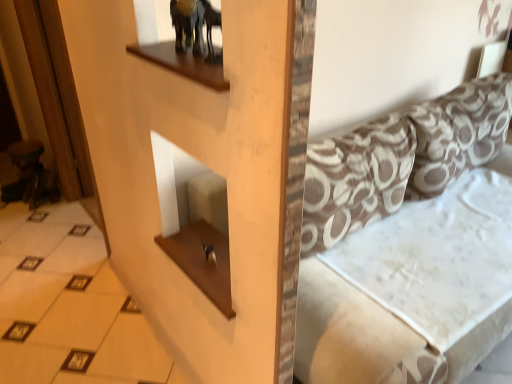
Question: Could you tell me if white glossy tile at lower left is turned towards patterned fabric pillow at right, which is counted as the 1th pillow, starting from the right?

Choices:
 (A) yes
 (B) no

Answer: (B)

Question: Is white glossy tile at lower left wider than patterned fabric pillow at right, the 2th pillow positioned from the left?

Choices:
 (A) no
 (B) yes

Answer: (B)

Question: From the image's perspective, does white glossy tile at lower left appear lower than patterned fabric pillow at right, which is counted as the 1th pillow, starting from the right?

Choices:
 (A) no
 (B) yes

Answer: (B)

Question: Would you say white glossy tile at lower left is outside patterned fabric pillow at right, the 2th pillow positioned from the left?

Choices:
 (A) yes
 (B) no

Answer: (A)

Question: Is white glossy tile at lower left turned away from patterned fabric pillow at right, which is counted as the 1th pillow, starting from the right?

Choices:
 (A) no
 (B) yes

Answer: (A)

Question: Considering the relative sizes of white glossy tile at lower left and patterned fabric pillow at right, which is counted as the 1th pillow, starting from the right, in the image provided, is white glossy tile at lower left thinner than patterned fabric pillow at right, which is counted as the 1th pillow, starting from the right,?

Choices:
 (A) no
 (B) yes

Answer: (A)

Question: From the image's perspective, is brown printed fabric pillow at upper right, the first pillow in the left-to-right sequence, on top of patterned fabric couch at center?

Choices:
 (A) yes
 (B) no

Answer: (A)

Question: Can you see brown printed fabric pillow at upper right, the 2th pillow positioned from the right, touching patterned fabric couch at center?

Choices:
 (A) yes
 (B) no

Answer: (B)

Question: Is brown printed fabric pillow at upper right, the first pillow in the left-to-right sequence, wider than patterned fabric couch at center?

Choices:
 (A) no
 (B) yes

Answer: (A)

Question: Is the depth of brown printed fabric pillow at upper right, the first pillow in the left-to-right sequence, less than that of patterned fabric couch at center?

Choices:
 (A) yes
 (B) no

Answer: (B)

Question: Would you say brown printed fabric pillow at upper right, the 2th pillow positioned from the right, contains patterned fabric couch at center?

Choices:
 (A) no
 (B) yes

Answer: (A)

Question: From a real-world perspective, is brown printed fabric pillow at upper right, the 2th pillow positioned from the right, beneath patterned fabric couch at center?

Choices:
 (A) no
 (B) yes

Answer: (A)

Question: Is white glossy tile at lower left closer to camera compared to patterned fabric couch at center?

Choices:
 (A) yes
 (B) no

Answer: (B)